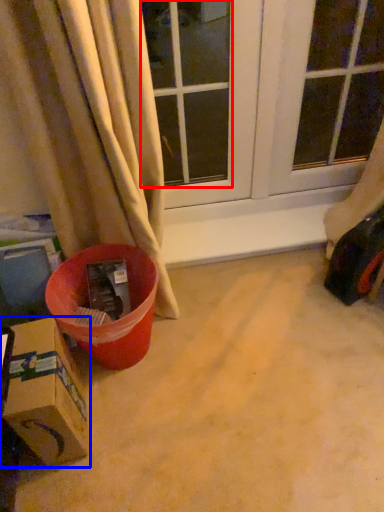
Question: Among these objects, which one is nearest to the camera, window (highlighted by a red box) or box (highlighted by a blue box)?

Choices:
 (A) window
 (B) box

Answer: (B)